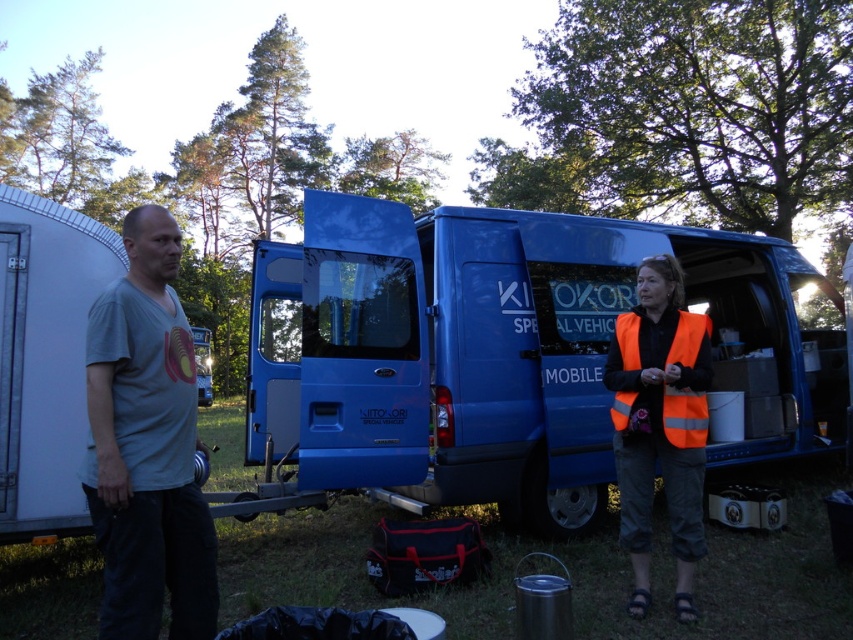
You are a worker who needs to choose a vest for visibility. You see an orange reflective vest at center and an orange reflective safety vest at right. Which one should you choose based on size?

The orange reflective vest at center is larger in size than the orange reflective safety vest at right, so you should choose the orange reflective vest at center for better visibility.